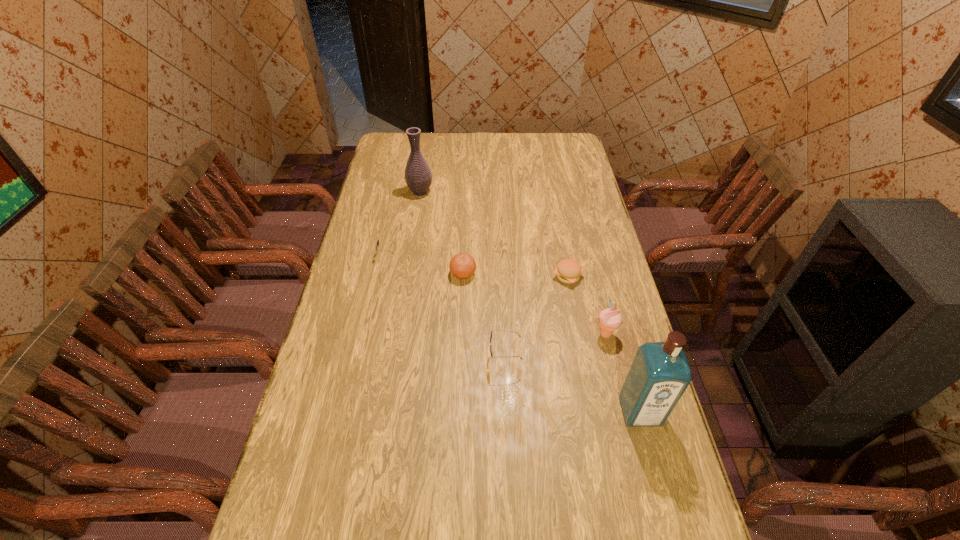
You are a GUI agent. You are given a task and a screenshot of the screen. Output one action in this format:
    pyautogui.click(x=<x>, y=<y>)
    Task: Click on the free space located 0.320m in front of the lenses of the nearer sunglasses
    Image resolution: width=960 pixels, height=540 pixels.
    Given the screenshot: What is the action you would take?
    pyautogui.click(x=376, y=359)

I want to click on vacant space situated in front of the lenses of the nearer sunglasses, so click(356, 359).

Locate an element on the screen. vacant space positioned 0.280m in front of the lenses of the nearer sunglasses is located at coordinates (391, 359).

At what (x,y) coordinates should I click in order to perform the action: click on free space located 0.060m on the right of the farthest object. Please return your answer as a coordinate pair (x, y). The height and width of the screenshot is (540, 960). Looking at the image, I should click on (448, 192).

Where is `vacant space positioned 0.130m on the back of the icecream`? The height and width of the screenshot is (540, 960). vacant space positioned 0.130m on the back of the icecream is located at coordinates (595, 294).

Find the location of a particular element. The image size is (960, 540). free space located 0.180m on the front of the third object from left to right is located at coordinates (461, 326).

Locate an element on the screen. free space located 0.160m on the flat label side of the liquor is located at coordinates (662, 495).

Identify the location of vacant space located on the left of the hamburger. This screenshot has height=540, width=960. (484, 276).

This screenshot has width=960, height=540. What are the coordinates of `sunglasses present at the left edge` in the screenshot? It's located at (377, 243).

Locate an element on the screen. This screenshot has height=540, width=960. vase that is at the left edge is located at coordinates (418, 176).